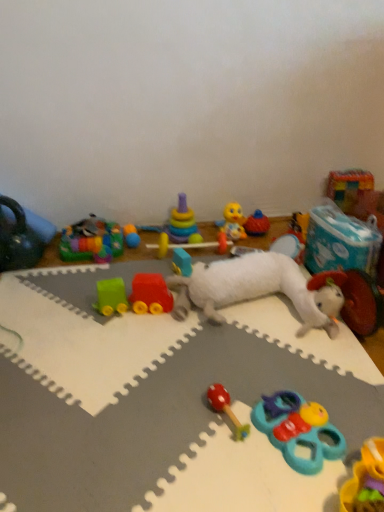
Where is `vacant space underneath matte black kettlebell at left, placed as the 15th toy when sorted from right to left (from a real-world perspective)`? vacant space underneath matte black kettlebell at left, placed as the 15th toy when sorted from right to left (from a real-world perspective) is located at coordinates (36, 260).